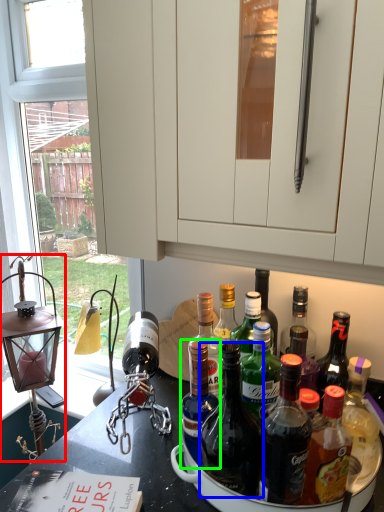
Question: Which object is positioned farthest from oil lamp (highlighted by a red box)? Select from bottle (highlighted by a blue box) and bottle (highlighted by a green box).

Choices:
 (A) bottle
 (B) bottle

Answer: (A)